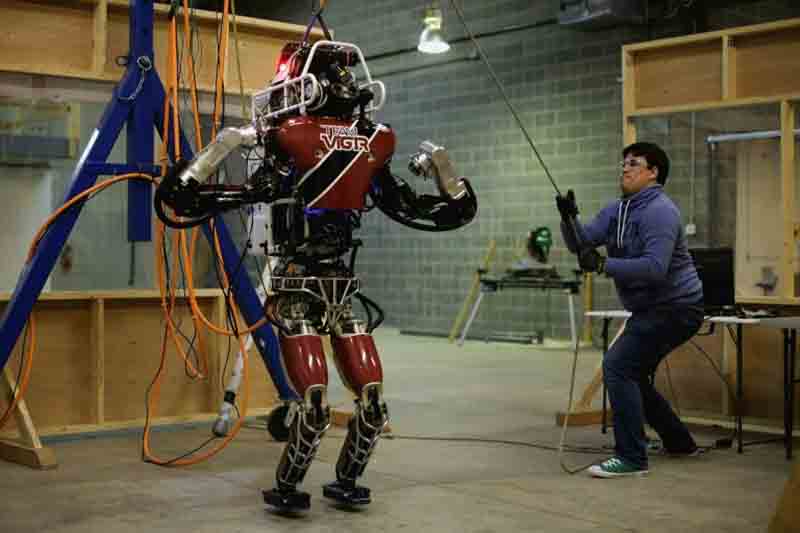
Image resolution: width=800 pixels, height=533 pixels. What are the coordinates of `lamp` in the screenshot? It's located at (433, 31).